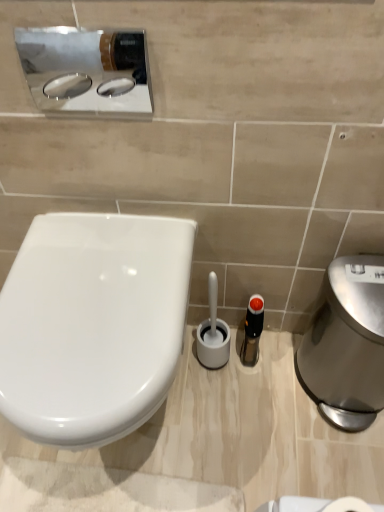
Image resolution: width=384 pixels, height=512 pixels. Find the location of `free spot in front of polished stainless steel hand dryer at right`. free spot in front of polished stainless steel hand dryer at right is located at coordinates (331, 467).